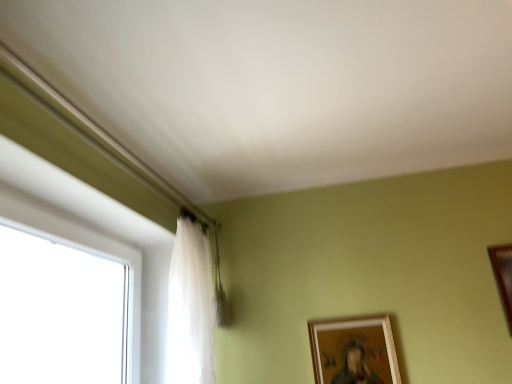
Find the location of a particular element. The width and height of the screenshot is (512, 384). wooden picture frame at lower right, acting as the second picture frame starting from the right is located at coordinates (354, 350).

Describe the element at coordinates (354, 350) in the screenshot. Image resolution: width=512 pixels, height=384 pixels. I see `wooden picture frame at lower right, arranged as the first picture frame when viewed from the left` at that location.

The width and height of the screenshot is (512, 384). I want to click on wooden picture frame at right, which is counted as the 1th picture frame, starting from the right, so click(503, 277).

Measure the distance between translucent fabric curtain at left and camera.

translucent fabric curtain at left and camera are 1.61 meters apart from each other.

Find the location of a particular element. This screenshot has width=512, height=384. wooden picture frame at lower right, arranged as the first picture frame when viewed from the left is located at coordinates (354, 350).

Consider the image. Considering the sizes of objects wooden picture frame at lower right, which appears as the first picture frame when ordered from the bottom, and translucent fabric curtain at left in the image provided, who is bigger, wooden picture frame at lower right, which appears as the first picture frame when ordered from the bottom, or translucent fabric curtain at left?

translucent fabric curtain at left is bigger.

Considering the relative positions of wooden picture frame at lower right, the 2th picture frame in the top-to-bottom sequence, and translucent fabric curtain at left in the image provided, is wooden picture frame at lower right, the 2th picture frame in the top-to-bottom sequence, to the right of translucent fabric curtain at left from the viewer's perspective?

Yes, wooden picture frame at lower right, the 2th picture frame in the top-to-bottom sequence, is to the right of translucent fabric curtain at left.

Looking at this image, is wooden picture frame at lower right, acting as the second picture frame starting from the right, aimed at translucent fabric curtain at left?

No, wooden picture frame at lower right, acting as the second picture frame starting from the right, is not aimed at translucent fabric curtain at left.

Which of these two, wooden picture frame at lower right, acting as the second picture frame starting from the right, or translucent fabric curtain at left, is thinner?

wooden picture frame at lower right, acting as the second picture frame starting from the right, is thinner.

Between wooden picture frame at lower right, the 2th picture frame in the top-to-bottom sequence, and wooden picture frame at right, positioned as the 1th picture frame in top-to-bottom order, which one is positioned in front?

wooden picture frame at right, positioned as the 1th picture frame in top-to-bottom order, is more forward.

From a real-world perspective, is wooden picture frame at lower right, which appears as the first picture frame when ordered from the bottom, positioned above or below wooden picture frame at right, which ranks as the second picture frame in bottom-to-top order?

From a real-world perspective, wooden picture frame at lower right, which appears as the first picture frame when ordered from the bottom, is physically below wooden picture frame at right, which ranks as the second picture frame in bottom-to-top order.

Which is less distant, (x=358, y=382) or (x=490, y=256)?

Point (x=358, y=382) is positioned closer to the camera compared to point (x=490, y=256).

From a real-world perspective, who is located higher, wooden picture frame at right, which is counted as the second picture frame, starting from the left, or wooden picture frame at lower right, the 2th picture frame in the top-to-bottom sequence?

In real-world perspective, wooden picture frame at right, which is counted as the second picture frame, starting from the left, is above.

Who is taller, wooden picture frame at right, which is counted as the second picture frame, starting from the left, or wooden picture frame at lower right, which appears as the first picture frame when ordered from the bottom?

Standing taller between the two is wooden picture frame at right, which is counted as the second picture frame, starting from the left.

Can you confirm if wooden picture frame at right, which is counted as the second picture frame, starting from the left, is thinner than wooden picture frame at lower right, the 2th picture frame in the top-to-bottom sequence?

Correct, the width of wooden picture frame at right, which is counted as the second picture frame, starting from the left, is less than that of wooden picture frame at lower right, the 2th picture frame in the top-to-bottom sequence.

How many degrees apart are the facing directions of wooden picture frame at right, which is counted as the second picture frame, starting from the left, and translucent fabric curtain at left?

The angular difference between wooden picture frame at right, which is counted as the second picture frame, starting from the left, and translucent fabric curtain at left is 89.8 degrees.

Measure the distance from wooden picture frame at right, positioned as the 1th picture frame in top-to-bottom order, to translucent fabric curtain at left.

wooden picture frame at right, positioned as the 1th picture frame in top-to-bottom order, and translucent fabric curtain at left are 1.30 meters apart from each other.

Can you see wooden picture frame at right, which ranks as the second picture frame in bottom-to-top order, touching translucent fabric curtain at left?

wooden picture frame at right, which ranks as the second picture frame in bottom-to-top order, and translucent fabric curtain at left are not in contact.

From the image's perspective, is wooden picture frame at right, positioned as the 1th picture frame in top-to-bottom order, located above translucent fabric curtain at left?

Yes.

Is translucent fabric curtain at left positioned with its back to wooden picture frame at lower right, the 2th picture frame in the top-to-bottom sequence?

No, translucent fabric curtain at left's orientation is not away from wooden picture frame at lower right, the 2th picture frame in the top-to-bottom sequence.

Consider the image. Between translucent fabric curtain at left and wooden picture frame at lower right, arranged as the first picture frame when viewed from the left, which one has smaller width?

Answer: With smaller width is wooden picture frame at lower right, arranged as the first picture frame when viewed from the left.

Can you confirm if translucent fabric curtain at left is shorter than wooden picture frame at lower right, which appears as the first picture frame when ordered from the bottom?

In fact, translucent fabric curtain at left may be taller than wooden picture frame at lower right, which appears as the first picture frame when ordered from the bottom.

Is translucent fabric curtain at left bigger or smaller than wooden picture frame at lower right, which appears as the first picture frame when ordered from the bottom?

translucent fabric curtain at left is bigger than wooden picture frame at lower right, which appears as the first picture frame when ordered from the bottom.

Between translucent fabric curtain at left and wooden picture frame at right, which ranks as the second picture frame in bottom-to-top order, which one has less height?

wooden picture frame at right, which ranks as the second picture frame in bottom-to-top order, is shorter.

Looking at this image, from a real-world perspective, is translucent fabric curtain at left located beneath wooden picture frame at right, which ranks as the second picture frame in bottom-to-top order?

No, from a real-world perspective, translucent fabric curtain at left is not beneath wooden picture frame at right, which ranks as the second picture frame in bottom-to-top order.

Does translucent fabric curtain at left have a smaller size compared to wooden picture frame at right, which ranks as the second picture frame in bottom-to-top order?

No, translucent fabric curtain at left is not smaller than wooden picture frame at right, which ranks as the second picture frame in bottom-to-top order.

From the translucent fabric curtain at left, count 2nd picture frame to the right and point to it. Please provide its 2D coordinates.

[(503, 277)]

At what (x,y) coordinates should I click in order to perform the action: click on picture frame located below the translucent fabric curtain at left (from the image's perspective). Please return your answer as a coordinate pair (x, y). Looking at the image, I should click on (354, 350).

The width and height of the screenshot is (512, 384). What are the coordinates of `picture frame on the left of wooden picture frame at right, positioned as the 1th picture frame in top-to-bottom order` in the screenshot? It's located at (354, 350).

Which object lies further to the anchor point wooden picture frame at right, which is counted as the 1th picture frame, starting from the right, translucent fabric curtain at left or wooden picture frame at lower right, acting as the second picture frame starting from the right?

Among the two, translucent fabric curtain at left is located further to wooden picture frame at right, which is counted as the 1th picture frame, starting from the right.

When comparing their distances from wooden picture frame at lower right, which appears as the first picture frame when ordered from the bottom, does translucent fabric curtain at left or wooden picture frame at right, which is counted as the 1th picture frame, starting from the right, seem further?

Based on the image, wooden picture frame at right, which is counted as the 1th picture frame, starting from the right, appears to be further to wooden picture frame at lower right, which appears as the first picture frame when ordered from the bottom.

Looking at the image, which one is located further to wooden picture frame at right, which is counted as the second picture frame, starting from the left, wooden picture frame at lower right, which appears as the first picture frame when ordered from the bottom, or translucent fabric curtain at left?

translucent fabric curtain at left.

Based on their spatial positions, is wooden picture frame at right, which is counted as the second picture frame, starting from the left, or wooden picture frame at lower right, the 2th picture frame in the top-to-bottom sequence, further from translucent fabric curtain at left?

wooden picture frame at right, which is counted as the second picture frame, starting from the left, lies further to translucent fabric curtain at left than the other object.

Estimate the real-world distances between objects in this image. Which object is further from translucent fabric curtain at left, wooden picture frame at lower right, the 2th picture frame in the top-to-bottom sequence, or wooden picture frame at right, positioned as the 1th picture frame in top-to-bottom order?

The object further to translucent fabric curtain at left is wooden picture frame at right, positioned as the 1th picture frame in top-to-bottom order.

Looking at the image, which one is located closer to wooden picture frame at lower right, which appears as the first picture frame when ordered from the bottom, wooden picture frame at right, which ranks as the second picture frame in bottom-to-top order, or translucent fabric curtain at left?

translucent fabric curtain at left.

This screenshot has height=384, width=512. In order to click on picture frame situated between translucent fabric curtain at left and wooden picture frame at right, which is counted as the second picture frame, starting from the left, from left to right in this screenshot , I will do pyautogui.click(x=354, y=350).